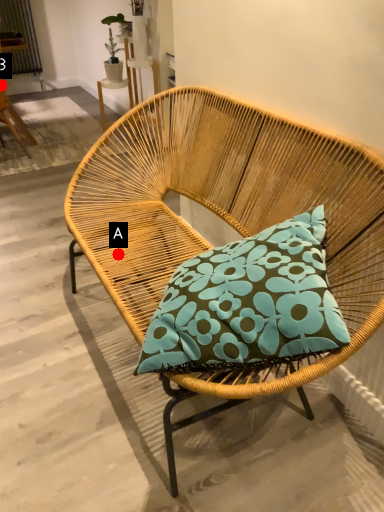
Question: Two points are circled on the image, labeled by A and B beside each circle. Among these points, which one is nearest to the camera?

Choices:
 (A) A is closer
 (B) B is closer

Answer: (A)